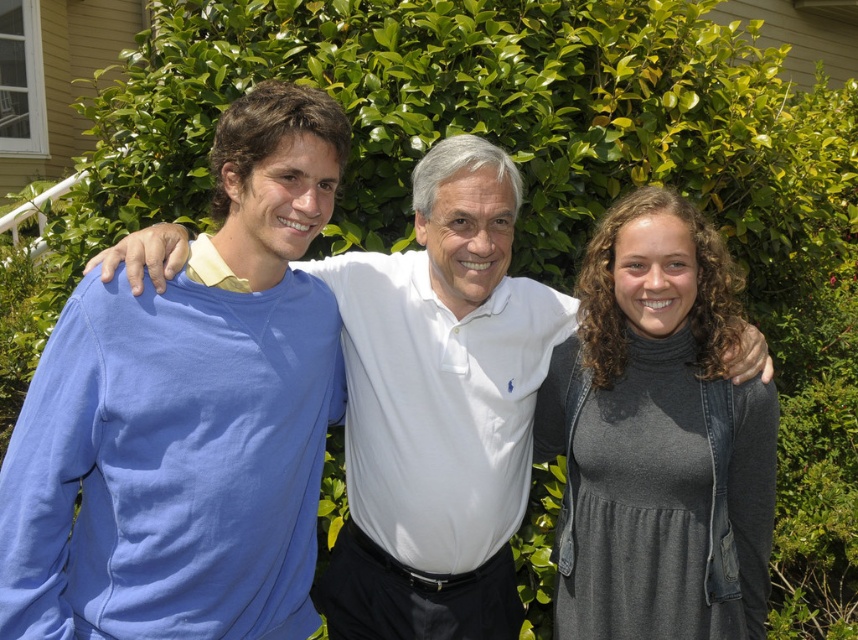
Question: Which point is farther to the camera?

Choices:
 (A) (288, 605)
 (B) (717, 339)

Answer: (B)

Question: From the image, what is the correct spatial relationship of blue cotton shirt at left in relation to gray matte dress at center?

Choices:
 (A) below
 (B) above

Answer: (B)

Question: Can you confirm if blue cotton shirt at left is wider than gray matte dress at center?

Choices:
 (A) yes
 (B) no

Answer: (A)

Question: In this image, where is blue cotton shirt at left located relative to gray matte dress at center?

Choices:
 (A) left
 (B) right

Answer: (A)